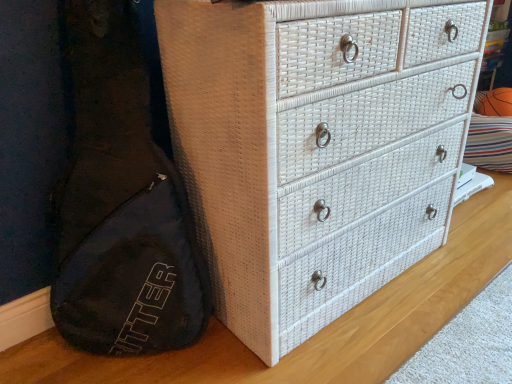
Describe the element at coordinates (316, 147) in the screenshot. I see `white wicker chest of drawers at center` at that location.

Identify the location of white wicker chest of drawers at center. Image resolution: width=512 pixels, height=384 pixels. (316, 147).

The height and width of the screenshot is (384, 512). What do you see at coordinates (496, 103) in the screenshot?
I see `orange rubber basketball at upper right` at bounding box center [496, 103].

You are a GUI agent. You are given a task and a screenshot of the screen. Output one action in this format:
    pyautogui.click(x=<x>, y=<y>)
    Task: Click on the orange rubber basketball at upper right
    The height and width of the screenshot is (384, 512).
    Given the screenshot: What is the action you would take?
    pyautogui.click(x=496, y=103)

Measure the distance between orange rubber basketball at upper right and camera.

The distance of orange rubber basketball at upper right from camera is 2.29 meters.

Identify the location of white wicker chest of drawers at center. The width and height of the screenshot is (512, 384). (316, 147).

Visually, is orange rubber basketball at upper right positioned to the left or to the right of white wicker chest of drawers at center?

orange rubber basketball at upper right is to the right of white wicker chest of drawers at center.

Which is behind, orange rubber basketball at upper right or white wicker chest of drawers at center?

Positioned behind is orange rubber basketball at upper right.

Considering the points (484, 110) and (189, 175), which point is in front, point (484, 110) or point (189, 175)?

The point (189, 175) is closer to the camera.

From the image's perspective, would you say orange rubber basketball at upper right is positioned over white wicker chest of drawers at center?

Yes, from the image's perspective, orange rubber basketball at upper right is above white wicker chest of drawers at center.

From a real-world perspective, which is physically above, orange rubber basketball at upper right or white wicker chest of drawers at center?

white wicker chest of drawers at center is physically above.

Considering the sizes of objects orange rubber basketball at upper right and white wicker chest of drawers at center in the image provided, who is thinner, orange rubber basketball at upper right or white wicker chest of drawers at center?

orange rubber basketball at upper right.

Who is shorter, orange rubber basketball at upper right or white wicker chest of drawers at center?

Standing shorter between the two is orange rubber basketball at upper right.

Can you confirm if orange rubber basketball at upper right is smaller than white wicker chest of drawers at center?

Yes, orange rubber basketball at upper right is smaller than white wicker chest of drawers at center.

Could white wicker chest of drawers at center be considered to be inside orange rubber basketball at upper right?

No, white wicker chest of drawers at center is not surrounded by orange rubber basketball at upper right.

Are orange rubber basketball at upper right and white wicker chest of drawers at center far apart?

Indeed, orange rubber basketball at upper right is not near white wicker chest of drawers at center.

Is orange rubber basketball at upper right facing away from white wicker chest of drawers at center?

No, orange rubber basketball at upper right is not facing the opposite direction of white wicker chest of drawers at center.

Consider the image. What's the angular difference between orange rubber basketball at upper right and white wicker chest of drawers at center's facing directions?

They differ by 15 degrees in their facing directions.

Where is `chest of drawers located on the left of orange rubber basketball at upper right`? The width and height of the screenshot is (512, 384). chest of drawers located on the left of orange rubber basketball at upper right is located at coordinates (316, 147).

Considering the positions of objects white wicker chest of drawers at center and orange rubber basketball at upper right in the image provided, who is more to the left, white wicker chest of drawers at center or orange rubber basketball at upper right?

From the viewer's perspective, white wicker chest of drawers at center appears more on the left side.

Considering their positions, is white wicker chest of drawers at center located in front of or behind orange rubber basketball at upper right?

white wicker chest of drawers at center is in front of orange rubber basketball at upper right.

Is point (164, 20) positioned behind point (488, 101)?

No, (164, 20) is closer to viewer.

From the image's perspective, which is below, white wicker chest of drawers at center or orange rubber basketball at upper right?

white wicker chest of drawers at center appears lower in the image.

In the scene shown: From a real-world perspective, is white wicker chest of drawers at center on top of orange rubber basketball at upper right?

Correct, in the physical world, white wicker chest of drawers at center is higher than orange rubber basketball at upper right.

Does white wicker chest of drawers at center have a lesser width compared to orange rubber basketball at upper right?

No.

Which of these two, white wicker chest of drawers at center or orange rubber basketball at upper right, stands taller?

With more height is white wicker chest of drawers at center.

Does white wicker chest of drawers at center have a larger size compared to orange rubber basketball at upper right?

Yes.

Does white wicker chest of drawers at center contain orange rubber basketball at upper right?

No.

Is white wicker chest of drawers at center positioned far away from orange rubber basketball at upper right?

Yes, white wicker chest of drawers at center is far from orange rubber basketball at upper right.

Is white wicker chest of drawers at center facing away from orange rubber basketball at upper right?

No, orange rubber basketball at upper right is not at the back of white wicker chest of drawers at center.

How many degrees apart are the facing directions of white wicker chest of drawers at center and orange rubber basketball at upper right?

The facing directions of white wicker chest of drawers at center and orange rubber basketball at upper right are 15 degrees apart.

How much distance is there between white wicker chest of drawers at center and orange rubber basketball at upper right?

They are 5.51 feet apart.

The image size is (512, 384). I want to click on basketball that appears above the white wicker chest of drawers at center (from the image's perspective), so point(496,103).

In order to click on basketball located behind the white wicker chest of drawers at center in this screenshot , I will do `click(496, 103)`.

Image resolution: width=512 pixels, height=384 pixels. I want to click on the chest of drawers in front of the orange rubber basketball at upper right, so click(x=316, y=147).